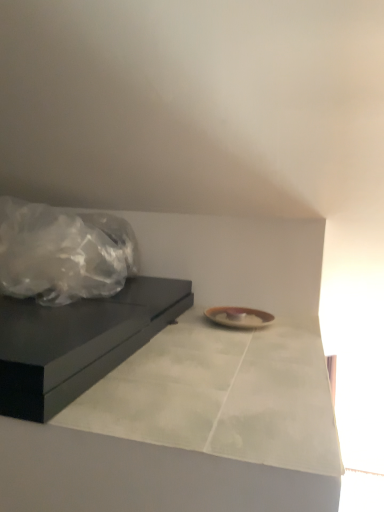
Image resolution: width=384 pixels, height=512 pixels. Find the location of `free spot above white marble countertop at center (from a real-world perspective)`. free spot above white marble countertop at center (from a real-world perspective) is located at coordinates (214, 347).